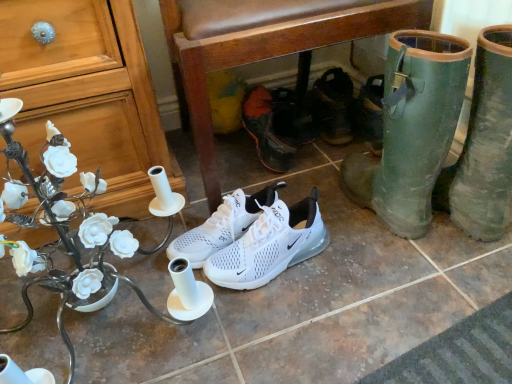
Question: From the image's perspective, is brown leather chair at center located beneath green rubber boots at lower right, marked as the fifth footwear in a back-to-front arrangement?

Choices:
 (A) no
 (B) yes

Answer: (A)

Question: Considering the relative sizes of brown leather chair at center and green rubber boots at lower right, marked as the fifth footwear in a back-to-front arrangement, in the image provided, is brown leather chair at center taller than green rubber boots at lower right, marked as the fifth footwear in a back-to-front arrangement,?

Choices:
 (A) yes
 (B) no

Answer: (A)

Question: Does brown leather chair at center have a smaller size compared to green rubber boots at lower right, the first footwear from the front?

Choices:
 (A) no
 (B) yes

Answer: (A)

Question: From the image's perspective, is brown leather chair at center over green rubber boots at lower right, the first footwear from the front?

Choices:
 (A) no
 (B) yes

Answer: (B)

Question: Are brown leather chair at center and green rubber boots at lower right, marked as the fifth footwear in a back-to-front arrangement, far apart?

Choices:
 (A) yes
 (B) no

Answer: (B)

Question: Based on their positions, is green rubber boots at lower right, marked as the fifth footwear in a back-to-front arrangement, located to the left or right of black leather sandals at center, acting as the 1th footwear starting from the back?

Choices:
 (A) right
 (B) left

Answer: (A)

Question: Do you think green rubber boots at lower right, the first footwear from the front, is within black leather sandals at center, placed as the fifth footwear when sorted from front to back, or outside of it?

Choices:
 (A) outside
 (B) inside

Answer: (A)

Question: Is green rubber boots at lower right, marked as the fifth footwear in a back-to-front arrangement, in front of or behind black leather sandals at center, placed as the fifth footwear when sorted from front to back, in the image?

Choices:
 (A) behind
 (B) front

Answer: (B)

Question: Is green rubber boots at lower right, the first footwear from the front, wider or thinner than black leather sandals at center, placed as the fifth footwear when sorted from front to back?

Choices:
 (A) thin
 (B) wide

Answer: (B)

Question: From their relative heights in the image, would you say white mesh shoe at center, arranged as the 4th footwear when viewed from the front, is taller or shorter than green rubber boots at lower right, marked as the fifth footwear in a back-to-front arrangement?

Choices:
 (A) short
 (B) tall

Answer: (A)

Question: Is white mesh shoe at center, arranged as the 4th footwear when viewed from the front, situated inside green rubber boots at lower right, the first footwear from the front, or outside?

Choices:
 (A) inside
 (B) outside

Answer: (B)

Question: Considering the positions of point (250, 104) and point (432, 34), is point (250, 104) closer or farther from the camera than point (432, 34)?

Choices:
 (A) closer
 (B) farther

Answer: (B)

Question: Is white mesh shoe at center, arranged as the 4th footwear when viewed from the front, in front of or behind green rubber boots at lower right, marked as the fifth footwear in a back-to-front arrangement, in the image?

Choices:
 (A) front
 (B) behind

Answer: (B)

Question: Is point (61, 289) positioned closer to the camera than point (184, 235)?

Choices:
 (A) closer
 (B) farther

Answer: (A)

Question: Relative to white mesh sneakers at center, marked as the third footwear in a back-to-front arrangement, is matte white desk at center in front or behind?

Choices:
 (A) front
 (B) behind

Answer: (A)